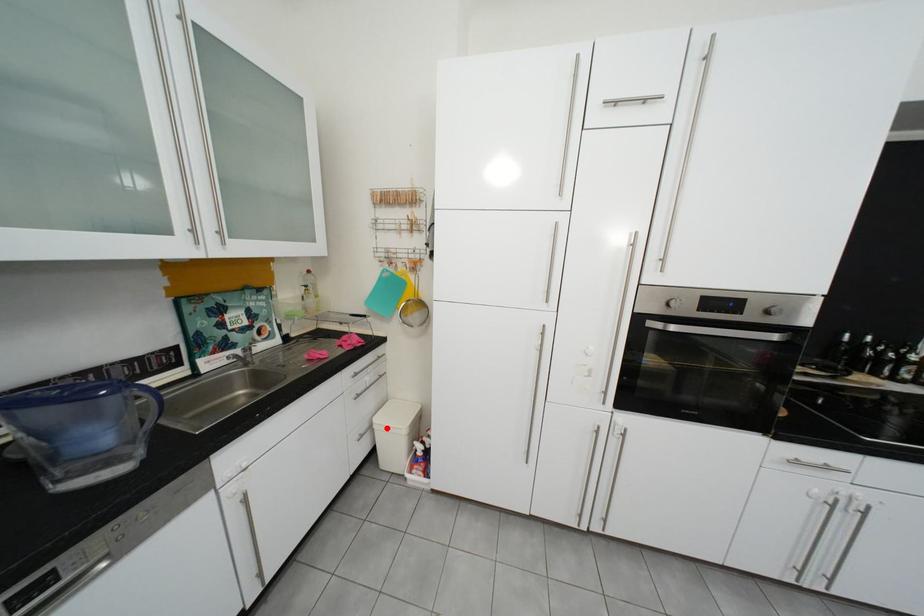
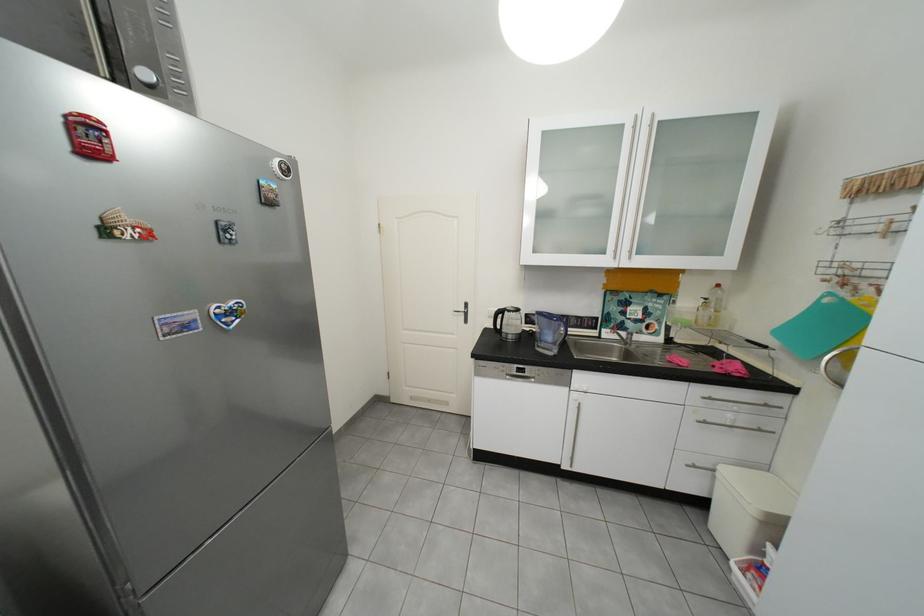
Where in the second image is the point corresponding to the highlighted location from the first image?

(730, 476)